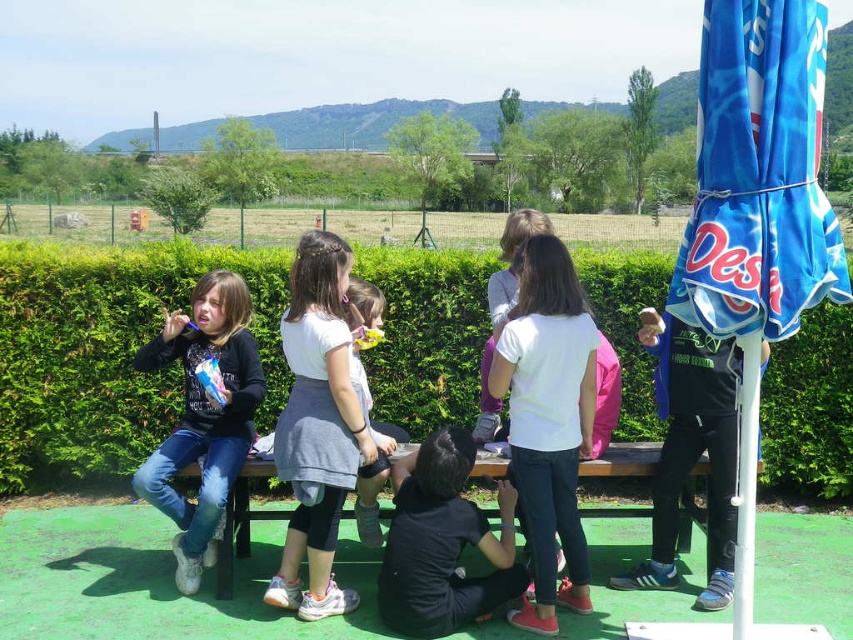
You are a parent trying to locate your child who is sitting on the green painted wood bench at center. You see the green leafy hedge at center in the background. Which side of the bench should you look to find your child?

The green leafy hedge at center is to the right of the green painted wood bench at center, so your child is on the left side of the bench.

You are a photographer trying to capture a group photo of the children. You notice the white matte shirt at center and the matte black shirt at left. Which child should you ask to move closer to fill the frame better?

The white matte shirt at center should move closer because it occupies less space than the matte black shirt at left, so moving closer would help balance the composition.